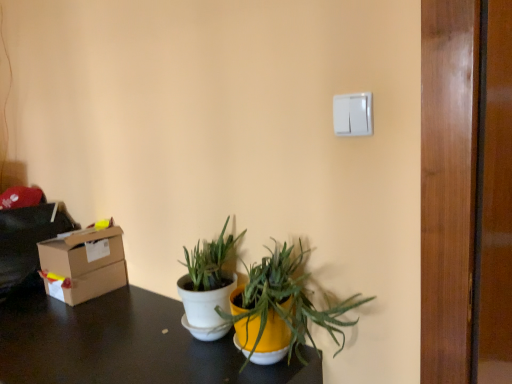
The height and width of the screenshot is (384, 512). I want to click on vacant point above matte black desk at lower center (from a real-world perspective), so click(x=86, y=335).